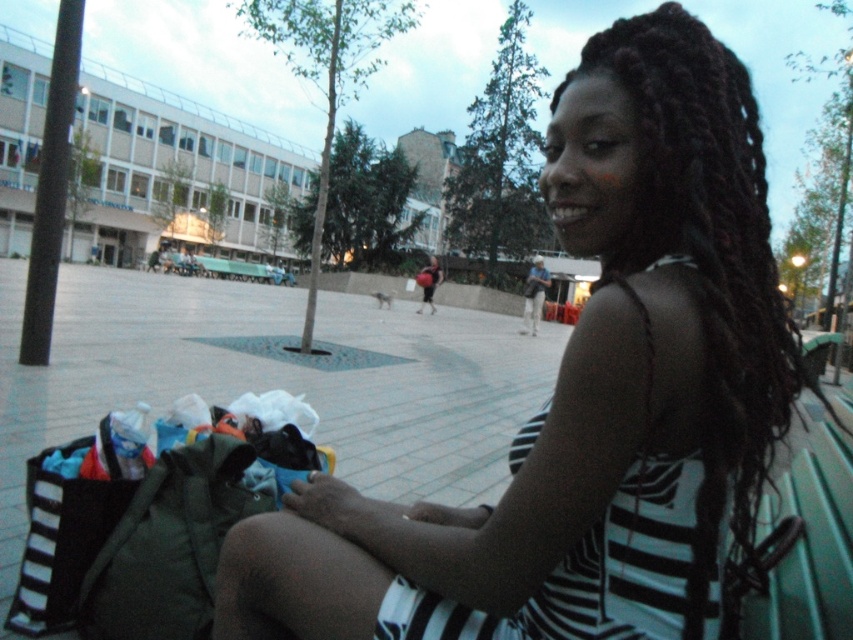
Question: Can you confirm if black striped dress at center is bigger than black curly hair at upper right?

Choices:
 (A) no
 (B) yes

Answer: (B)

Question: Which of the following is the closest to the observer?

Choices:
 (A) black striped dress at right
 (B) black striped dress at center
 (C) black curly hair at upper right

Answer: (A)

Question: Is black striped dress at center thinner than black curly hair at upper right?

Choices:
 (A) yes
 (B) no

Answer: (B)

Question: Is the position of black striped dress at center more distant than that of black striped dress at right?

Choices:
 (A) no
 (B) yes

Answer: (B)

Question: Estimate the real-world distances between objects in this image. Which object is closer to the black striped dress at right?

Choices:
 (A) black curly hair at upper right
 (B) black striped dress at center

Answer: (A)

Question: Which of the following is the closest to the observer?

Choices:
 (A) (670, 129)
 (B) (415, 573)
 (C) (527, 616)

Answer: (A)